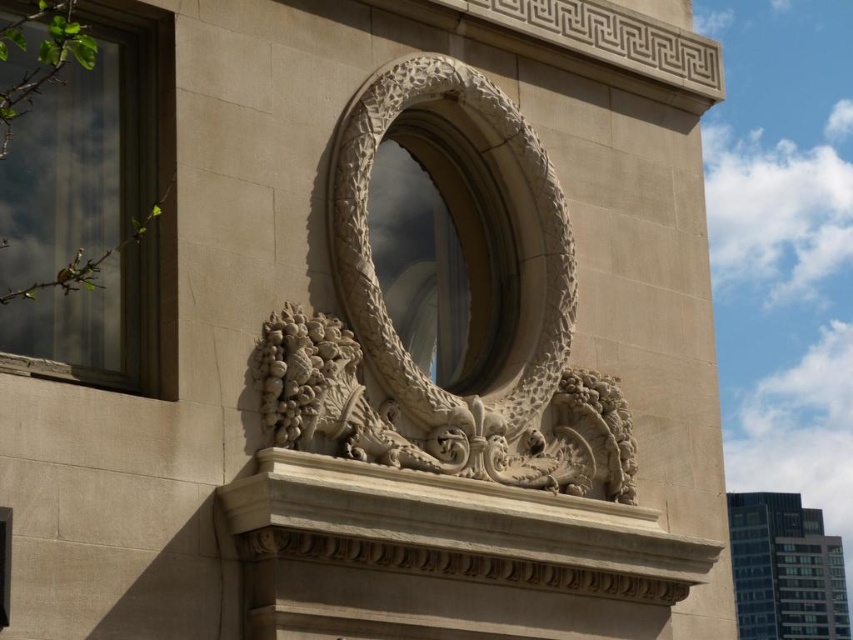
You are an architect designing a new building and want to ensure that the white stone dragon at center and the clear glass window at upper left are visible from the ground floor. Given that the dragon is taller than the window, which one would appear larger when viewed from below?

The white stone dragon at center would appear larger when viewed from below since it has a greater height compared to the clear glass window at upper left.

From the picture: You are an architect designing a new building inspired by this facade. You need to ensure the white stone dragon at center and the clear glass window at upper left fit within the planned dimensions. Which object has a greater width?

The white stone dragon at center has a greater width than the clear glass window at upper left according to the description.

You are standing in front of the building facade and want to reach the point at coordinates point (569, 426). Given that you can only move horizontally along the wall, can you estimate how far you need to walk to reach that point?

The point at coordinates point (569, 426) is 193.22 feet away from the viewer, so you would need to walk approximately 193.22 feet horizontally along the wall to reach it.